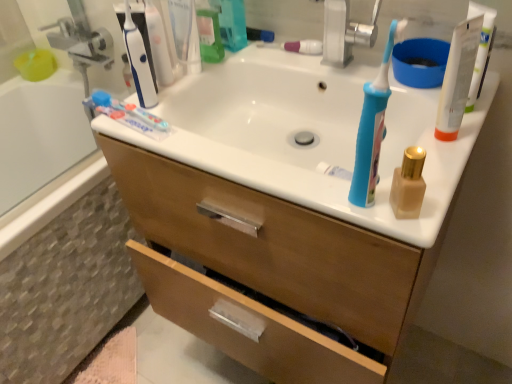
Where is `vacant space situated on the left part of blue plastic toothbrush at upper right`? This screenshot has height=384, width=512. vacant space situated on the left part of blue plastic toothbrush at upper right is located at coordinates (274, 180).